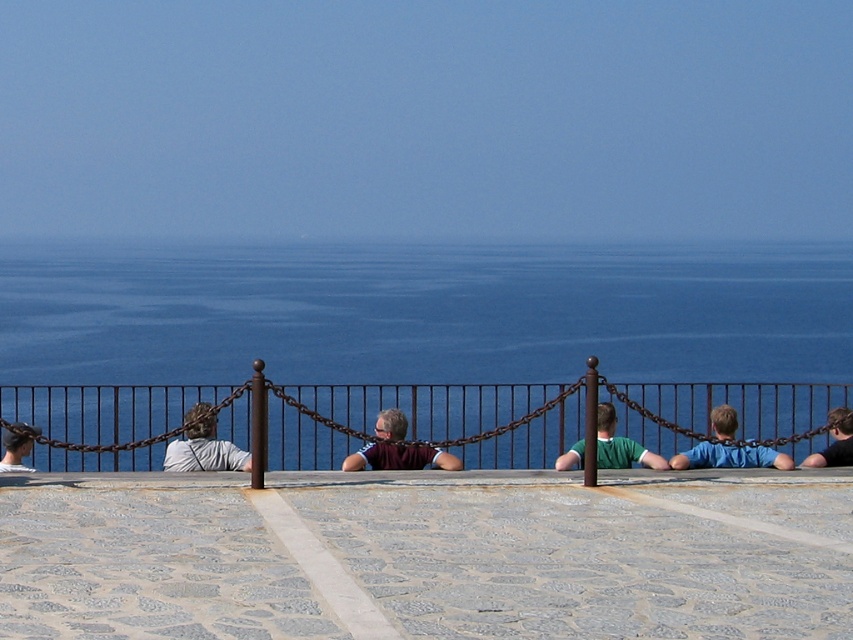
How distant is rusty metal fence at center from green fabric shirt at center?

2.27 meters

Locate an element on the screen. rusty metal fence at center is located at coordinates (426, 420).

The image size is (853, 640). In order to click on rusty metal fence at center in this screenshot , I will do `click(426, 420)`.

Looking at this image, which is more to the left, rusty metal fence at center or maroon shirt at center?

Positioned to the left is rusty metal fence at center.

Is point (605, 397) more distant than point (350, 454)?

No, it is in front of (350, 454).

Locate an element on the screen. The image size is (853, 640). rusty metal fence at center is located at coordinates (426, 420).

In the scene shown: Is blue water at center above rusty metal fence at center?

Correct, blue water at center is located above rusty metal fence at center.

Is blue water at center positioned before rusty metal fence at center?

No.

Does point (788, 317) come closer to viewer compared to point (544, 403)?

No, it is behind (544, 403).

Identify the location of blue water at center. (422, 312).